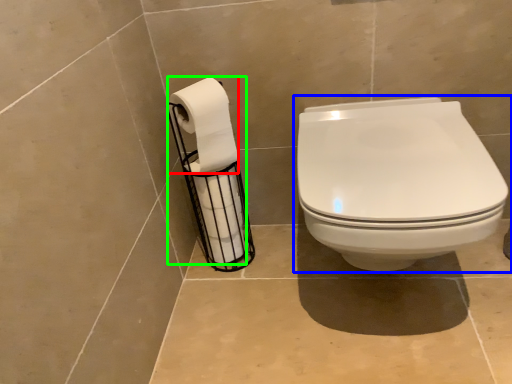
Question: Estimate the real-world distances between objects in this image. Which object is closer to toilet paper (highlighted by a red box), toilet (highlighted by a blue box) or toilet paper (highlighted by a green box)?

Choices:
 (A) toilet
 (B) toilet paper

Answer: (B)